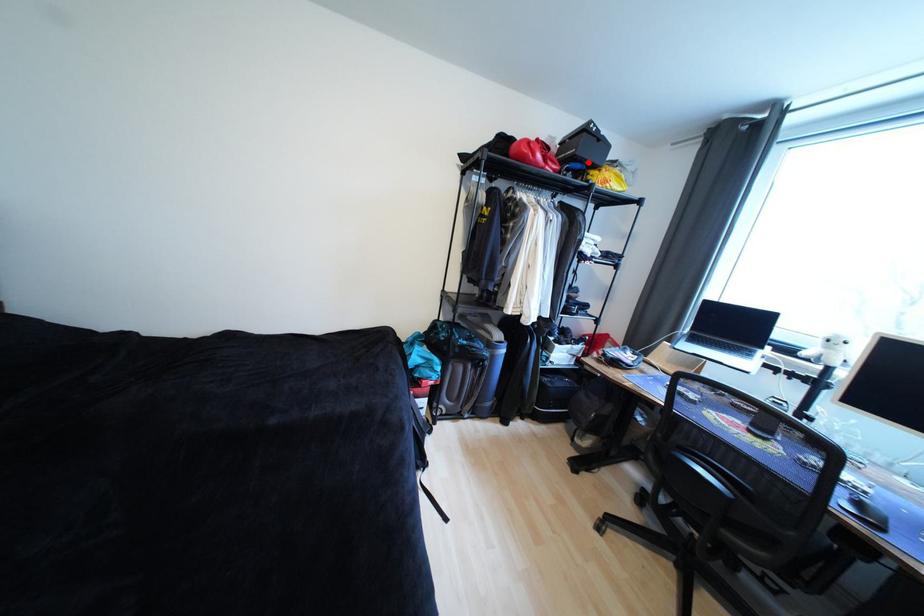
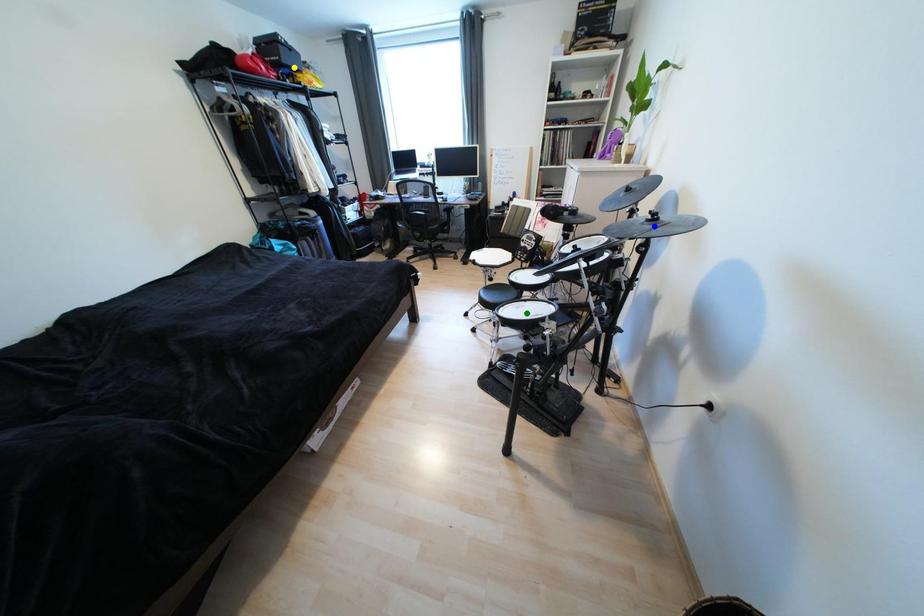
Question: I am providing you with two images of the same scene from different viewpoints. A red point is marked on the first image. You are given multiple points on the second image. Which mark in image 2 goes with the point in image 1?

Choices:
 (A) yellow point
 (B) blue point
 (C) green point

Answer: (A)